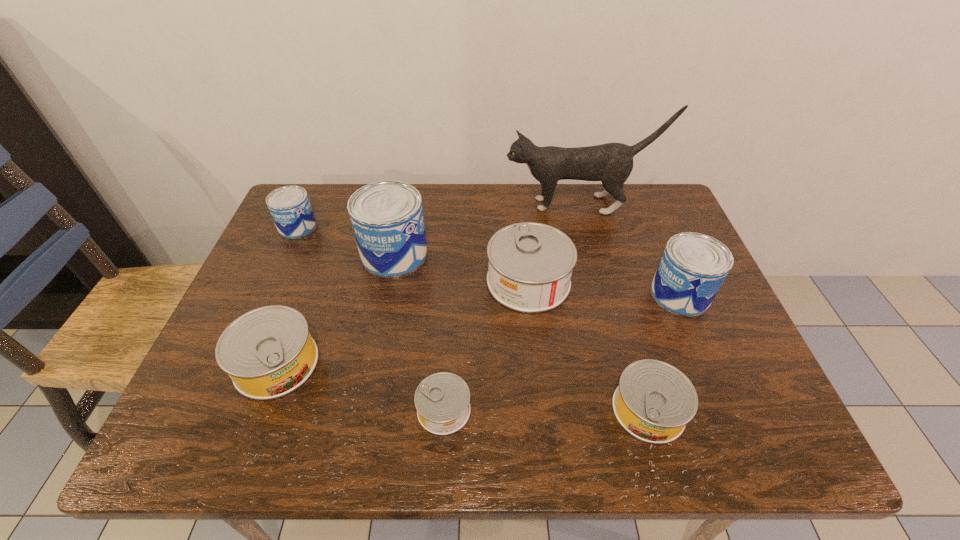
Find the location of a particular element. Image resolution: width=960 pixels, height=540 pixels. cat is located at coordinates (611, 163).

I want to click on the seventh shortest object, so click(387, 219).

Identify the location of the sixth object from right to left. (387, 219).

Find the location of a particular element. This screenshot has height=540, width=960. the sixth shortest can is located at coordinates (693, 267).

Identify the location of the second smallest blue can. (693, 267).

The image size is (960, 540). I want to click on the fifth can from left to right, so click(530, 266).

Locate an element on the screen. the farthest silver can is located at coordinates (530, 266).

At what (x,y) coordinates should I click in order to perform the action: click on the smallest blue can. Please return your answer as a coordinate pair (x, y). Looking at the image, I should click on (290, 208).

The image size is (960, 540). I want to click on the third smallest silver can, so click(268, 352).

You are a GUI agent. You are given a task and a screenshot of the screen. Output one action in this format:
    pyautogui.click(x=<x>, y=<y>)
    Task: Click on the rightmost silver can
    
    Given the screenshot: What is the action you would take?
    pyautogui.click(x=654, y=401)